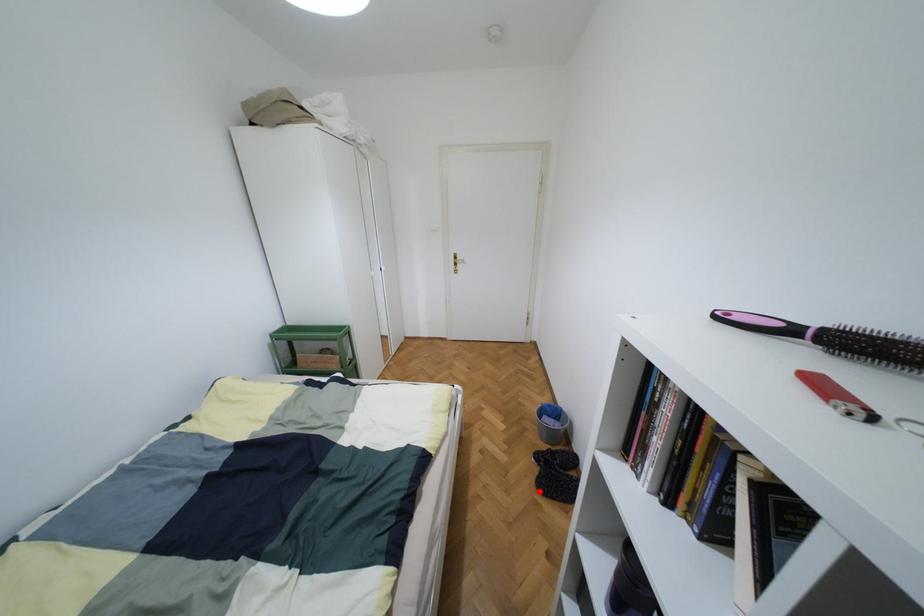
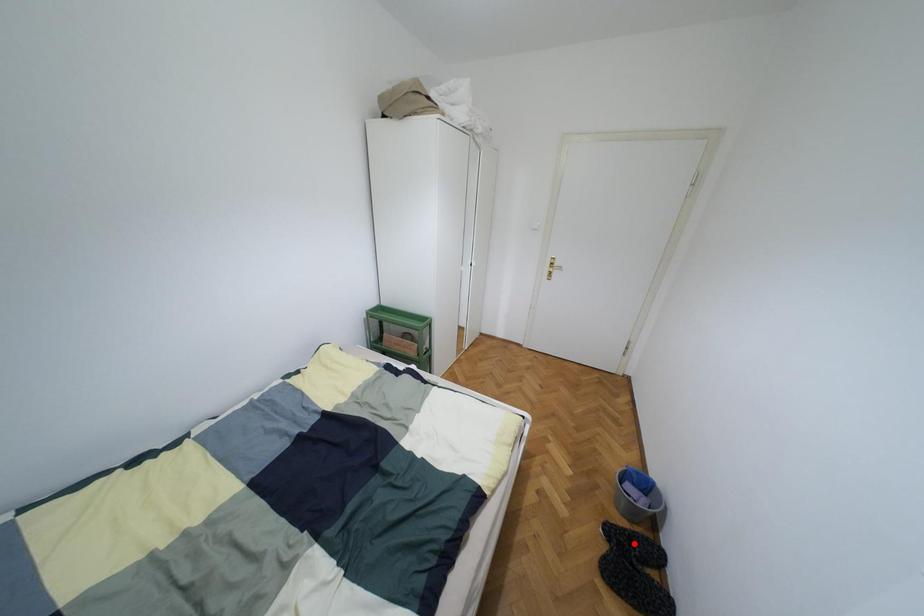
I am providing you with two images of the same scene from different viewpoints. A red point is marked on the first image and another point is marked on the second image. Are the points marked in image1 and image2 representing the same 3D position?

No